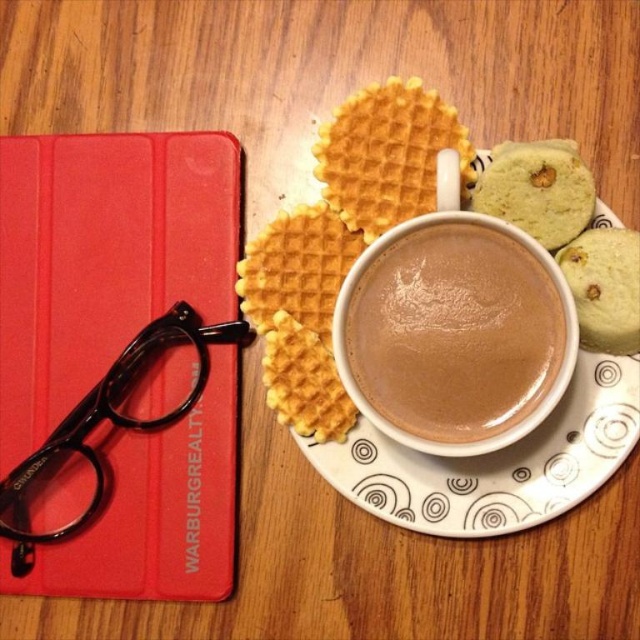
Does white ceramic saucer at upper center appear over green textured cookie at upper right?

No, white ceramic saucer at upper center is not above green textured cookie at upper right.

Based on the photo, does white ceramic saucer at upper center appear on the right side of green textured cookie at upper right?

In fact, white ceramic saucer at upper center is to the left of green textured cookie at upper right.

The width and height of the screenshot is (640, 640). I want to click on white ceramic saucer at upper center, so click(493, 461).

What do you see at coordinates (493, 461) in the screenshot?
I see `white ceramic saucer at upper center` at bounding box center [493, 461].

Is white ceramic saucer at upper center positioned at the back of golden waffle at center?

No, it is in front of golden waffle at center.

Between point (602, 472) and point (257, 300), which one is positioned in front?

Point (602, 472) is in front.

The image size is (640, 640). In order to click on white ceramic saucer at upper center in this screenshot , I will do `click(493, 461)`.

Does golden textured waffle at upper center have a lesser width compared to green crumbly cookie at right?

In fact, golden textured waffle at upper center might be wider than green crumbly cookie at right.

Which is in front, point (342, 184) or point (600, 280)?

Positioned in front is point (600, 280).

Image resolution: width=640 pixels, height=640 pixels. What are the coordinates of `golden textured waffle at upper center` in the screenshot? It's located at (387, 154).